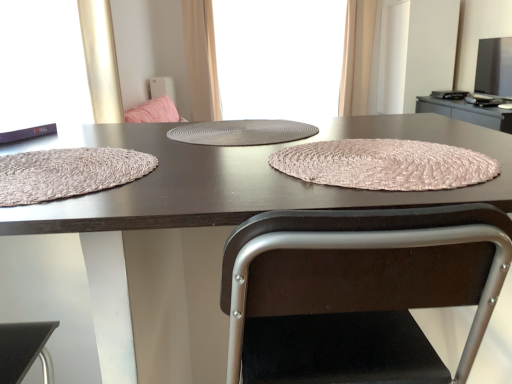
Question: Which direction should I rotate to look at pink woven placemat at center, which appears as the second blanket when viewed from the left?

Choices:
 (A) left
 (B) right

Answer: (B)

Question: Is matte brown placemat at center to the left of beige fabric curtain at upper right, the first curtain when ordered from right to left, from the viewer's perspective?

Choices:
 (A) yes
 (B) no

Answer: (A)

Question: Are matte brown placemat at center and beige fabric curtain at upper right, which is the 2th curtain from left to right, making contact?

Choices:
 (A) yes
 (B) no

Answer: (B)

Question: Is matte brown placemat at center not near beige fabric curtain at upper right, which is the 2th curtain from left to right?

Choices:
 (A) yes
 (B) no

Answer: (A)

Question: Does matte brown placemat at center have a lesser height compared to beige fabric curtain at upper right, the first curtain when ordered from right to left?

Choices:
 (A) yes
 (B) no

Answer: (A)

Question: From a real-world perspective, is matte brown placemat at center on top of beige fabric curtain at upper right, the first curtain when ordered from right to left?

Choices:
 (A) yes
 (B) no

Answer: (B)

Question: Is matte brown placemat at center at the right side of beige fabric curtain at upper right, the first curtain when ordered from right to left?

Choices:
 (A) yes
 (B) no

Answer: (B)

Question: From the image's perspective, is matte black book at left, the 2th window screen from the right, on top of beige fabric curtain at upper right, the first curtain when ordered from right to left?

Choices:
 (A) yes
 (B) no

Answer: (B)

Question: Considering the relative sizes of matte black book at left, marked as the first window screen in a left-to-right arrangement, and beige fabric curtain at upper right, the first curtain when ordered from right to left, in the image provided, is matte black book at left, marked as the first window screen in a left-to-right arrangement, bigger than beige fabric curtain at upper right, the first curtain when ordered from right to left,?

Choices:
 (A) yes
 (B) no

Answer: (B)

Question: Can you confirm if matte black book at left, the 2th window screen from the right, is thinner than beige fabric curtain at upper right, the first curtain when ordered from right to left?

Choices:
 (A) yes
 (B) no

Answer: (A)

Question: Would you consider matte black book at left, arranged as the first window screen when viewed from the front, to be distant from beige fabric curtain at upper right, which is the 2th curtain from left to right?

Choices:
 (A) no
 (B) yes

Answer: (B)

Question: Does matte black book at left, which appears as the first window screen when ordered from the bottom, appear on the left side of beige fabric curtain at upper right, the first curtain when ordered from right to left?

Choices:
 (A) yes
 (B) no

Answer: (A)

Question: From the image's perspective, is matte black book at left, the 2th window screen from the top, beneath beige fabric curtain at upper right, the first curtain when ordered from right to left?

Choices:
 (A) yes
 (B) no

Answer: (A)

Question: Considering the relative sizes of gray textured placemat at center and beige fabric curtain at upper right, the first curtain when ordered from right to left, in the image provided, is gray textured placemat at center wider than beige fabric curtain at upper right, the first curtain when ordered from right to left,?

Choices:
 (A) no
 (B) yes

Answer: (B)